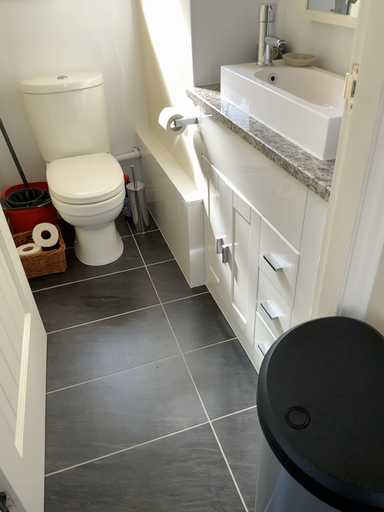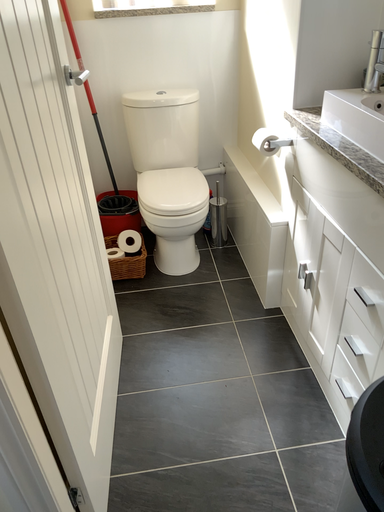
Question: Which way did the camera rotate in the video?

Choices:
 (A) rotated right
 (B) rotated left

Answer: (B)